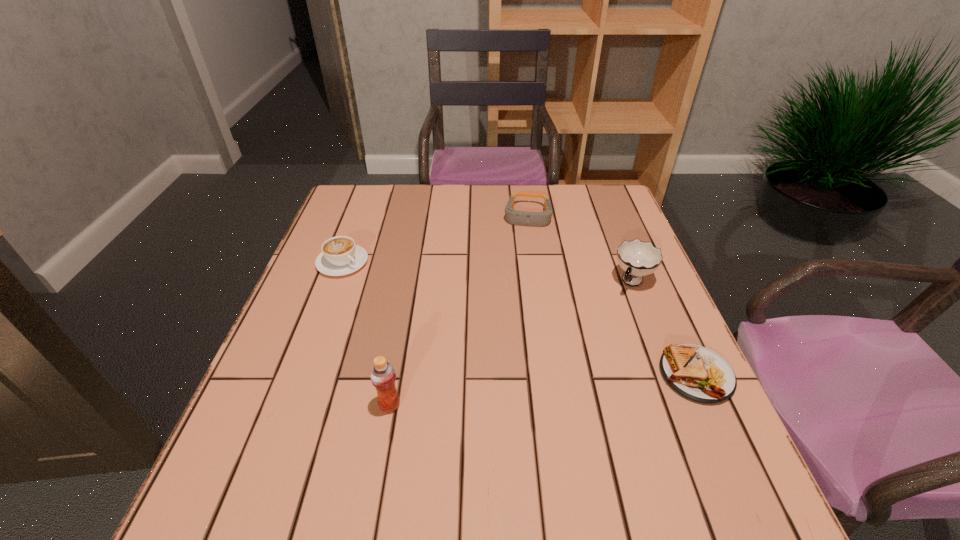
Where is `object identified as the second closest to the fourth shortest object`? object identified as the second closest to the fourth shortest object is located at coordinates (520, 218).

Locate an element on the screen. The image size is (960, 540). free space that satisfies the following two spatial constraints: 1. on the front side of the sandwich; 2. on the left side of the leftmost object is located at coordinates (301, 374).

Find the location of a particular element. This screenshot has width=960, height=540. free region that satisfies the following two spatial constraints: 1. on the front side of the sandwich; 2. on the left side of the cappuccino is located at coordinates (301, 374).

What are the coordinates of `free space that satisfies the following two spatial constraints: 1. on the front side of the shortest object; 2. on the left side of the cup` in the screenshot? It's located at (670, 374).

Locate an element on the screen. Image resolution: width=960 pixels, height=540 pixels. vacant space that satisfies the following two spatial constraints: 1. on the front side of the orange juice; 2. on the right side of the leftmost object is located at coordinates (290, 405).